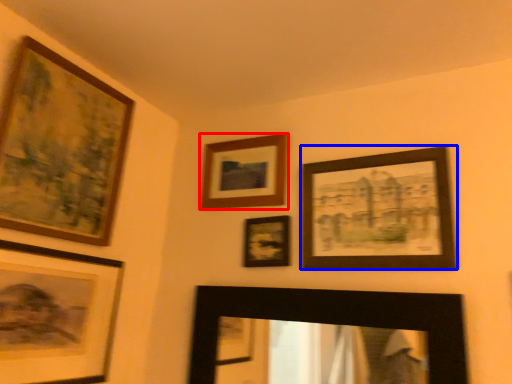
Question: Which of the following is the closest to the observer, picture frame (highlighted by a red box) or picture frame (highlighted by a blue box)?

Choices:
 (A) picture frame
 (B) picture frame

Answer: (B)